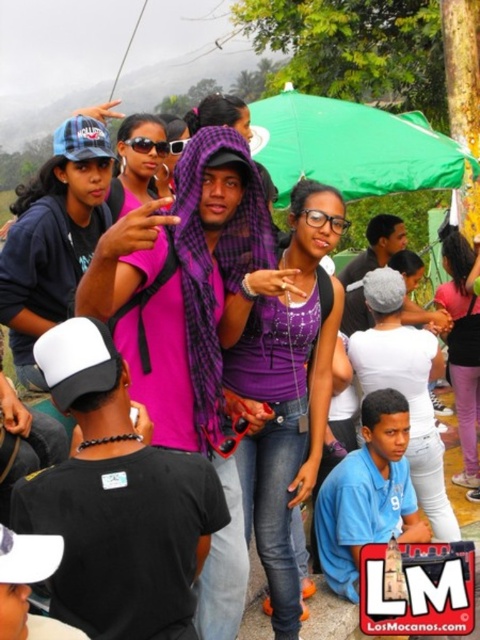
You are taking a photo of the scene and want to ensure both the green fabric umbrella at upper center and the pink fabric scarf at center are visible. Which object should you adjust the camera angle to focus on first to avoid blocking the other?

The green fabric umbrella at upper center is above the pink fabric scarf at center, so you should focus on adjusting the camera angle to include the green fabric umbrella at upper center first to ensure it doesn not block the lower positioned pink fabric scarf at center.

You are taking a photo of the lively outdoor gathering. You want to focus on the person making a peace sign gesture with their right hand while pointing towards the camera with their left. Which of the two points, point (x=312, y=444) or point (x=454, y=337), is closer to the camera and thus should be prioritized for focus?

Point (x=312, y=444) is closer to the camera than point (x=454, y=337), so it should be prioritized for focus.